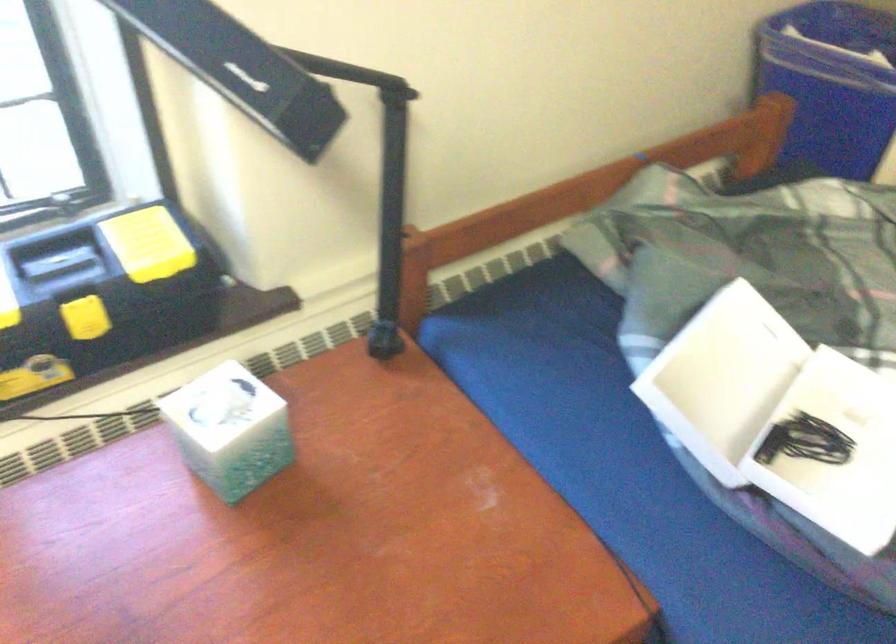
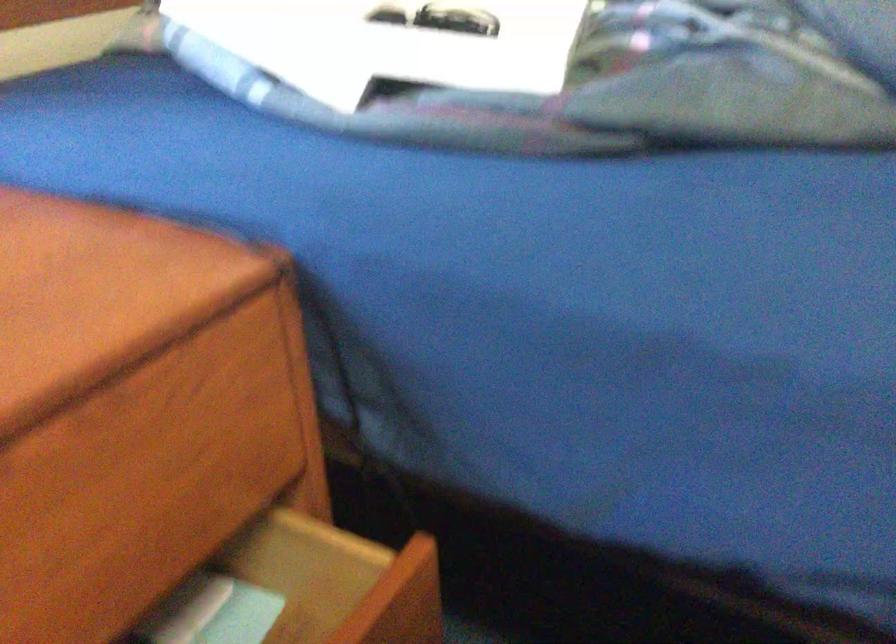
Question: How did the camera likely rotate?

Choices:
 (A) Left
 (B) Right
 (C) Up
 (D) Down

Answer: (B)